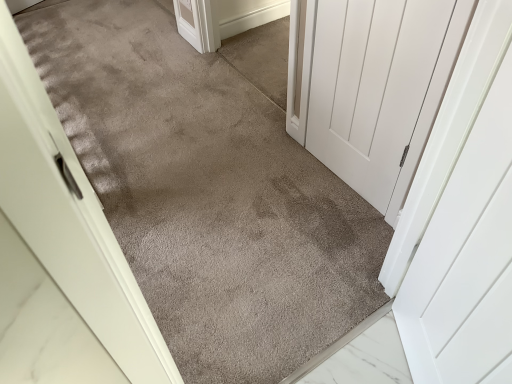
The image size is (512, 384). Find the location of `white matte door at center`. white matte door at center is located at coordinates (371, 86).

The height and width of the screenshot is (384, 512). What do you see at coordinates (371, 86) in the screenshot? I see `white matte door at center` at bounding box center [371, 86].

Where is `white matte door at center`? The image size is (512, 384). white matte door at center is located at coordinates (371, 86).